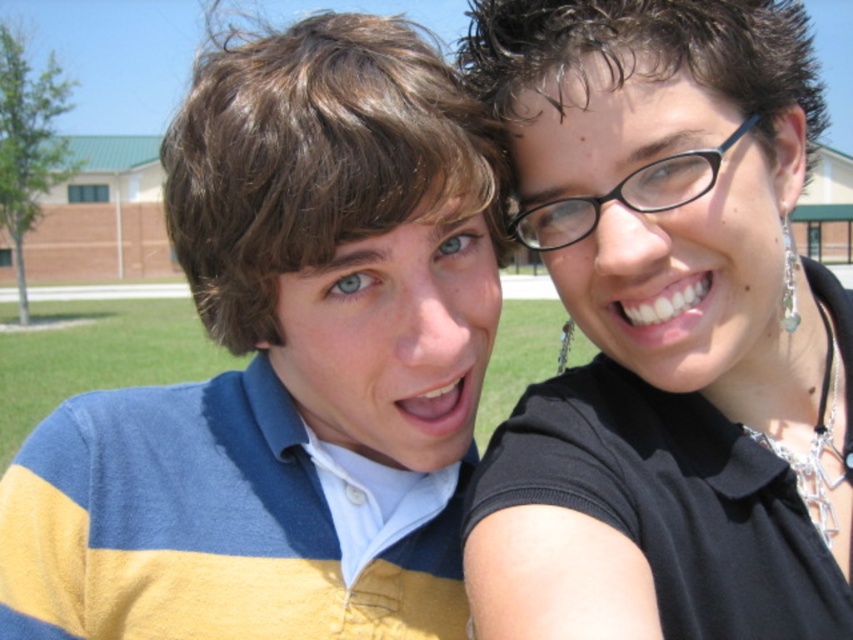
Is black glossy shirt at upper right wider than black plastic glasses at upper right?

Correct, the width of black glossy shirt at upper right exceeds that of black plastic glasses at upper right.

Which is in front, point (582, 310) or point (663, 163)?

Positioned in front is point (663, 163).

I want to click on black glossy shirt at upper right, so click(x=666, y=332).

Is yellow striped sweater at left above black glossy shirt at upper right?

Incorrect, yellow striped sweater at left is not positioned above black glossy shirt at upper right.

Is point (24, 454) farther from viewer compared to point (691, 291)?

That is True.

Which is behind, point (454, 586) or point (582, 550)?

The point (454, 586) is behind.

You are a GUI agent. You are given a task and a screenshot of the screen. Output one action in this format:
    pyautogui.click(x=<x>, y=<y>)
    Task: Click on the yellow striped sweater at left
    
    Given the screenshot: What is the action you would take?
    pyautogui.click(x=286, y=368)

Looking at this image, between yellow striped sweater at left and black plastic glasses at upper right, which one has more height?

yellow striped sweater at left is taller.

Who is more distant from viewer, (453, 428) or (520, 225)?

The point (453, 428) is more distant.

This screenshot has width=853, height=640. In order to click on yellow striped sweater at left in this screenshot , I will do `click(286, 368)`.